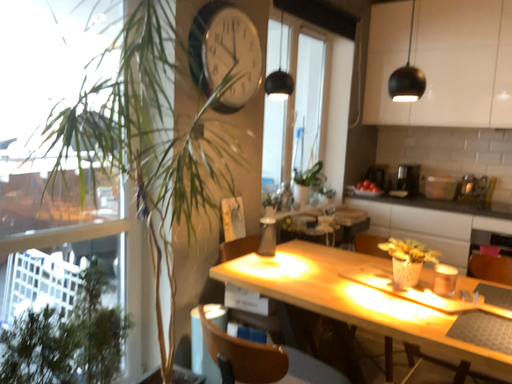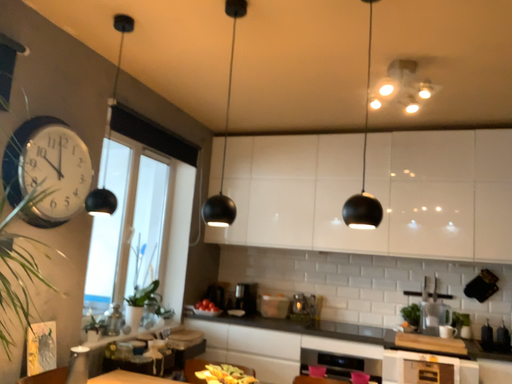
Question: How did the camera likely rotate when shooting the video?

Choices:
 (A) rotated right
 (B) rotated left

Answer: (A)